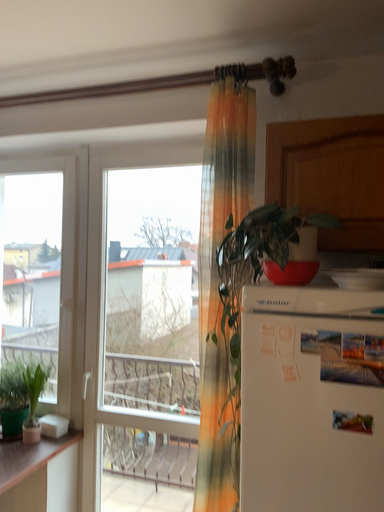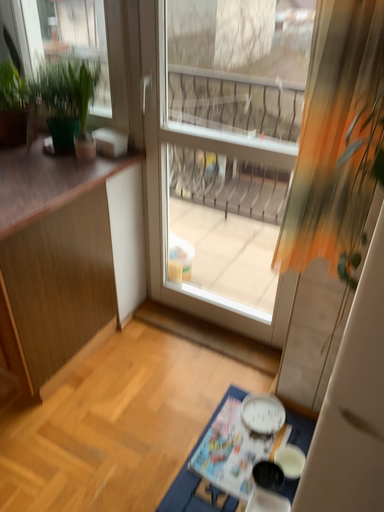
Question: How did the camera likely rotate when shooting the video?

Choices:
 (A) rotated right
 (B) rotated left

Answer: (B)